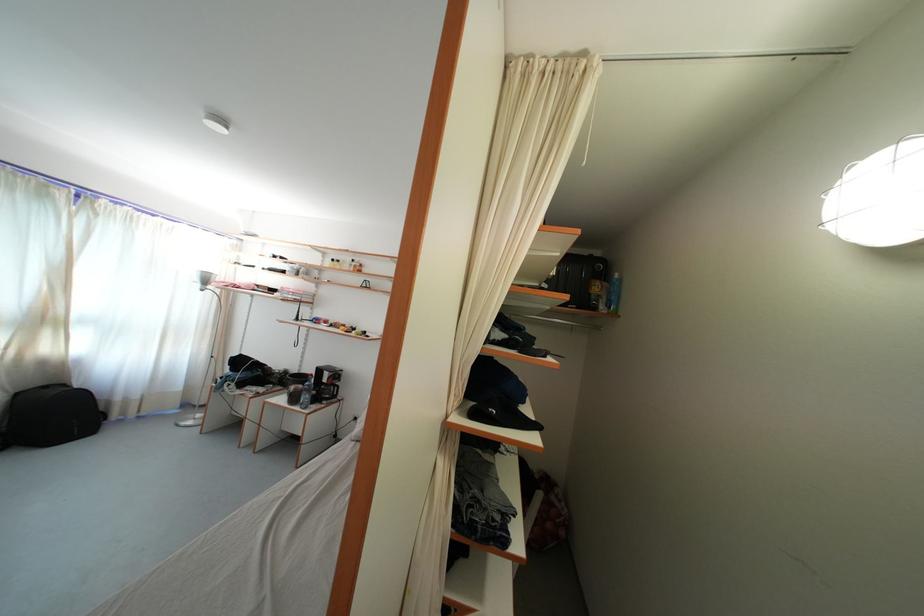
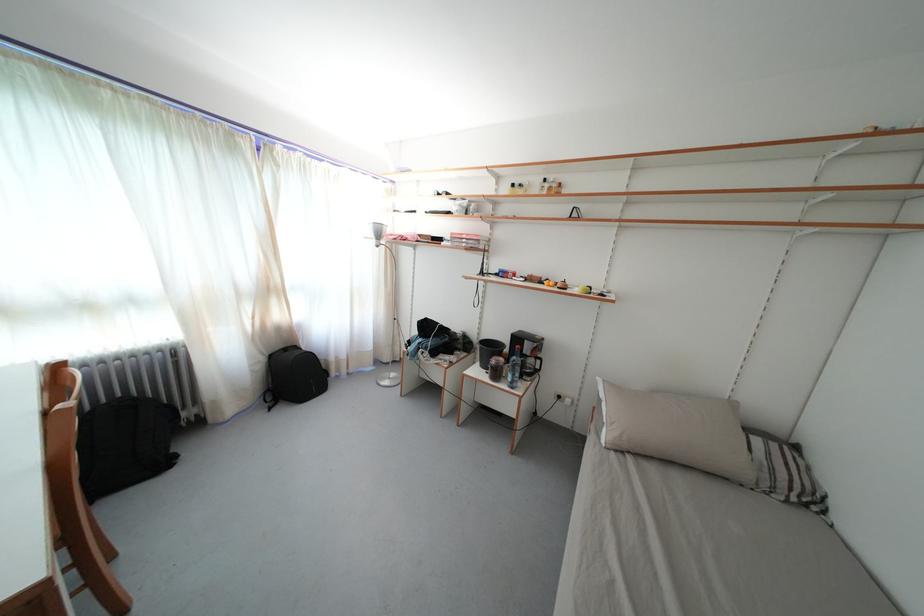
Where in the second image is the point corresponding to pixel 338 265 from the first image?

(518, 191)